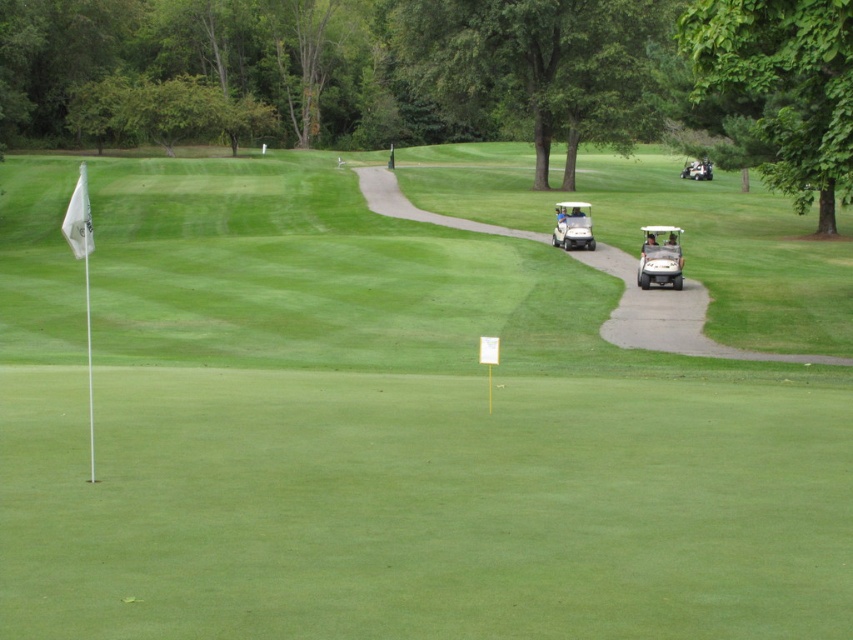
Does matte white golf cart at right have a lesser height compared to white plastic golf cart at center?

In fact, matte white golf cart at right may be taller than white plastic golf cart at center.

Does point (676, 285) come closer to viewer compared to point (560, 225)?

Yes, it is in front of point (560, 225).

Who is more distant from viewer, [675,268] or [587,248]?

The point [587,248] is behind.

Locate an element on the screen. The image size is (853, 640). matte white golf cart at right is located at coordinates (660, 259).